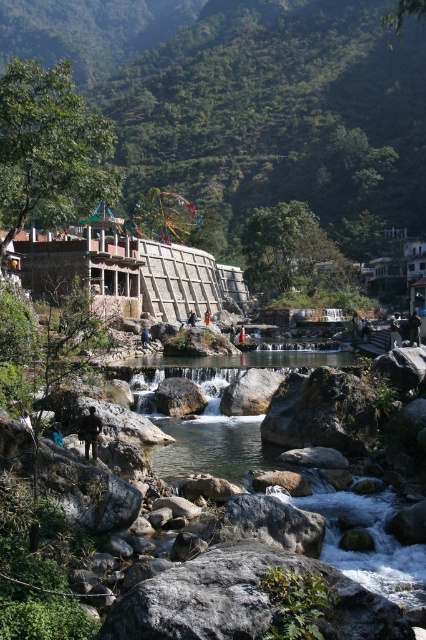
Who is more forward, (249,419) or (98,428)?

Positioned in front is point (98,428).

Looking at this image, which is more to the left, clear water stream at center or dark gray fabric person at center?

From the viewer's perspective, dark gray fabric person at center appears more on the left side.

Which is in front, point (183, 467) or point (89, 438)?

Point (89, 438)

At what (x,y) coordinates should I click in order to perform the action: click on clear water stream at center. Please return your answer as a coordinate pair (x, y). The image size is (426, 640). Looking at the image, I should click on [x=215, y=413].

Does green leafy hillside at upper center appear under dark gray fabric person at center?

No.

Is point (270, 0) in front of point (88, 438)?

No, (270, 0) is behind (88, 438).

In order to click on green leafy hillside at upper center in this screenshot , I will do `click(256, 108)`.

Between dark gray fabric person at center and blue fabric person at center, which one is positioned higher?

Positioned higher is blue fabric person at center.

Does dark gray fabric person at center appear on the right side of blue fabric person at center?

Correct, you'll find dark gray fabric person at center to the right of blue fabric person at center.

What do you see at coordinates (91, 433) in the screenshot?
I see `dark gray fabric person at center` at bounding box center [91, 433].

You are a GUI agent. You are given a task and a screenshot of the screen. Output one action in this format:
    pyautogui.click(x=<x>, y=<y>)
    Task: Click on the dark gray fabric person at center
    
    Given the screenshot: What is the action you would take?
    pyautogui.click(x=91, y=433)